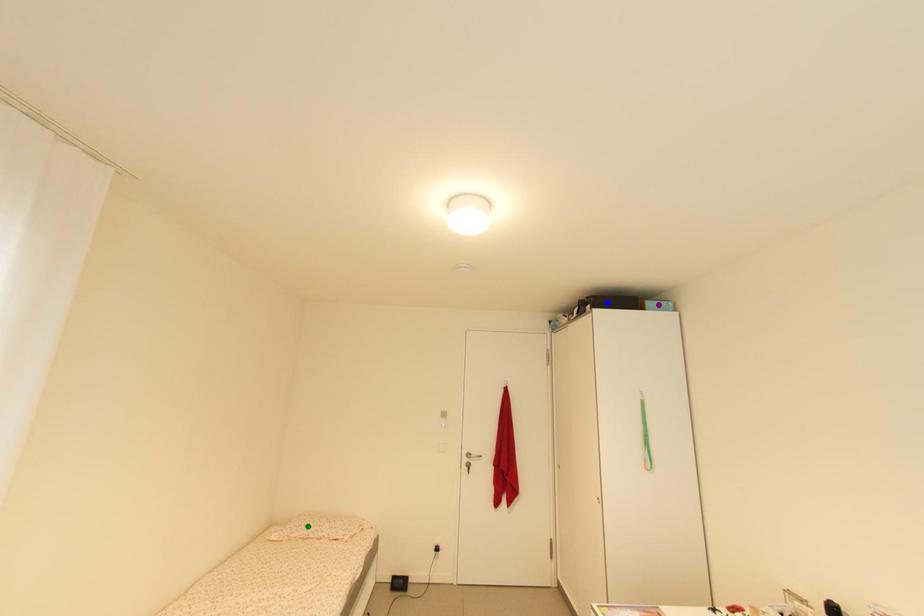
Order these from nearest to farthest:
blue point | purple point | green point

purple point
blue point
green point